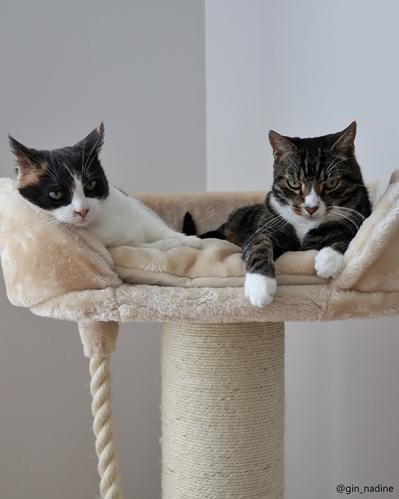
Find the location of a particular element. This screenshot has height=499, width=399. white fur is located at coordinates (125, 216), (299, 224).